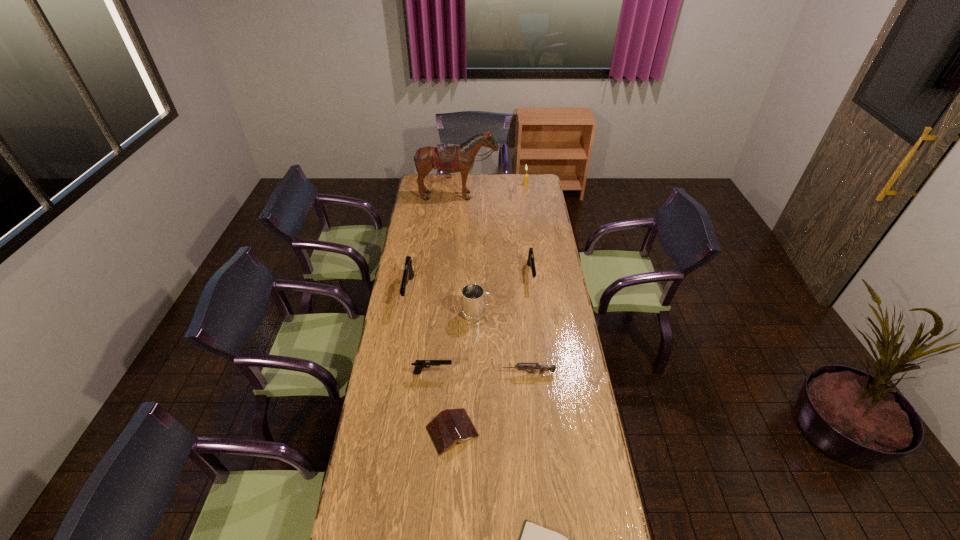
Find the location of a particular element. Image resolution: width=960 pixels, height=540 pixels. object that is at the far right corner is located at coordinates (x=525, y=183).

Where is `vacant region at the far edge of the desktop`? Image resolution: width=960 pixels, height=540 pixels. vacant region at the far edge of the desktop is located at coordinates (500, 179).

Where is `vacant space at the left edge of the desktop`? The image size is (960, 540). vacant space at the left edge of the desktop is located at coordinates (432, 208).

Where is `vacant space at the right edge`? This screenshot has width=960, height=540. vacant space at the right edge is located at coordinates (564, 469).

In the image, there is a desktop. At what (x,y) coordinates should I click in order to perform the action: click on vacant space at the far left corner. Please return your answer as a coordinate pair (x, y). Looking at the image, I should click on (436, 186).

Identify the location of vacant area at the far right corner of the desktop. (535, 185).

Where is `empty space between the nearest black gun and the rightmost black gun`? This screenshot has width=960, height=540. empty space between the nearest black gun and the rightmost black gun is located at coordinates (482, 324).

This screenshot has width=960, height=540. Find the location of `vacant space that is in between the cream candle and the grey gun`. vacant space that is in between the cream candle and the grey gun is located at coordinates (527, 279).

You are a GUI agent. You are given a task and a screenshot of the screen. Output one action in this format:
    pyautogui.click(x=<x>, y=<y>)
    Task: Click on the free spot between the seventh tallest object and the biggest black gun
    This screenshot has height=540, width=960.
    Given the screenshot: What is the action you would take?
    pyautogui.click(x=468, y=332)

Find the location of a particular element. The height and width of the screenshot is (540, 960). vacant area between the shortest gun and the second shortest object is located at coordinates (491, 402).